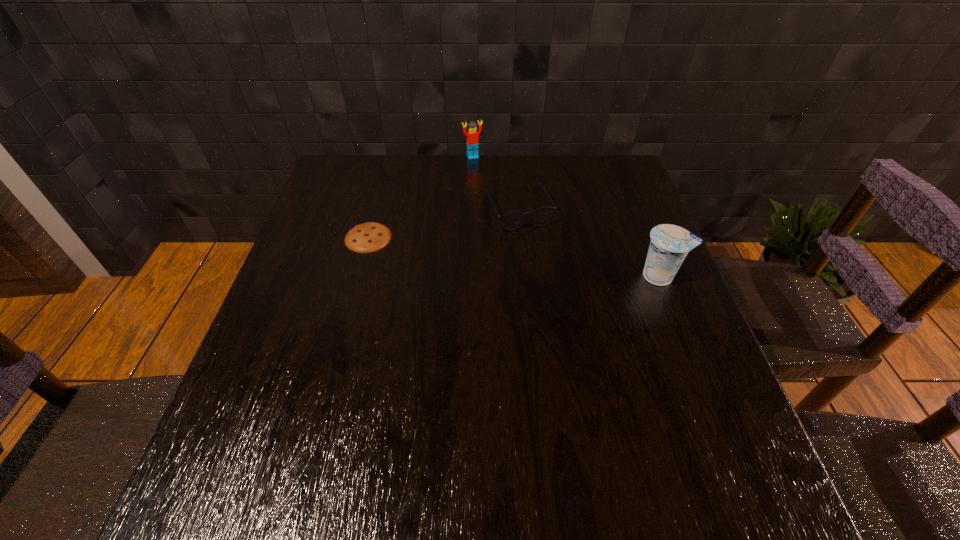
Image resolution: width=960 pixels, height=540 pixels. In order to click on free location that satisfies the following two spatial constraints: 1. on the front side of the farthest object; 2. on the right side of the spectacles in this screenshot , I will do `click(471, 208)`.